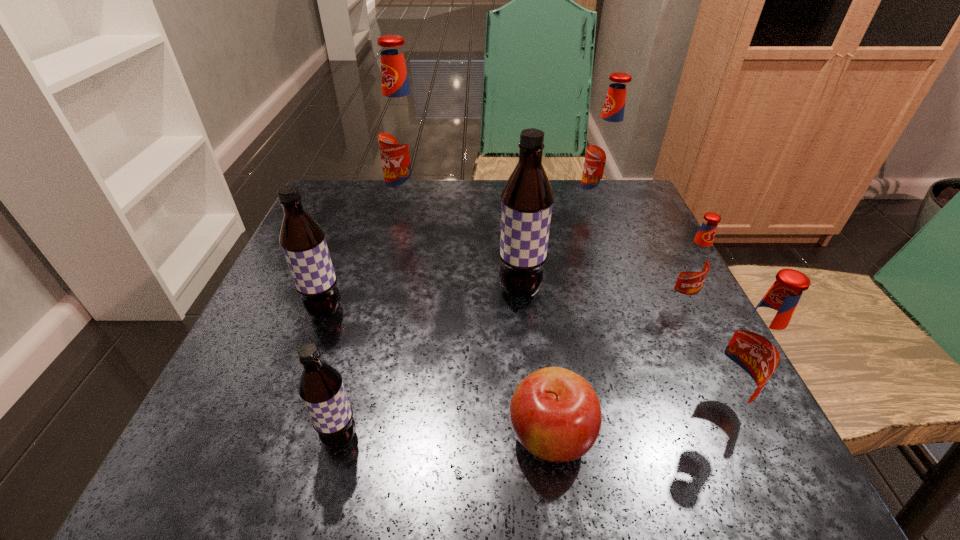
In the image, there is a desktop. Where is `vacant space at the far right corner`? vacant space at the far right corner is located at coordinates (647, 228).

Find the location of a particular element. The image size is (960, 540). blank area at the near right corner is located at coordinates coord(747,444).

You are a GUI agent. You are given a task and a screenshot of the screen. Output one action in this format:
    pyautogui.click(x=<x>, y=<y>)
    Task: Click on the free spot between the smallest brown root beer and the apple
    Image resolution: width=960 pixels, height=540 pixels.
    Given the screenshot: What is the action you would take?
    pyautogui.click(x=445, y=437)

Identify the location of unoccupied area between the third farthest red root beer and the fifth root beer from left to right. Image resolution: width=960 pixels, height=540 pixels. (637, 255).

What are the coordinates of `free spot between the leftmost root beer and the nearest red root beer` in the screenshot? It's located at (522, 357).

Locate an element on the screen. vacant area that lies between the fifth root beer from left to right and the shortest object is located at coordinates (573, 323).

At what (x,y) coordinates should I click in order to perform the action: click on free space between the tallest object and the fourth root beer from right to left. Please return your answer as a coordinate pair (x, y). The height and width of the screenshot is (540, 960). Looking at the image, I should click on (466, 248).

Locate an element on the screen. This screenshot has height=540, width=960. blank region between the leftmost brown root beer and the nearest red root beer is located at coordinates (522, 357).

Find the location of a particular element. The height and width of the screenshot is (540, 960). free space between the leftmost object and the nearest red root beer is located at coordinates (522, 357).

The image size is (960, 540). I want to click on vacant area that lies between the shortest object and the leftmost object, so click(438, 373).